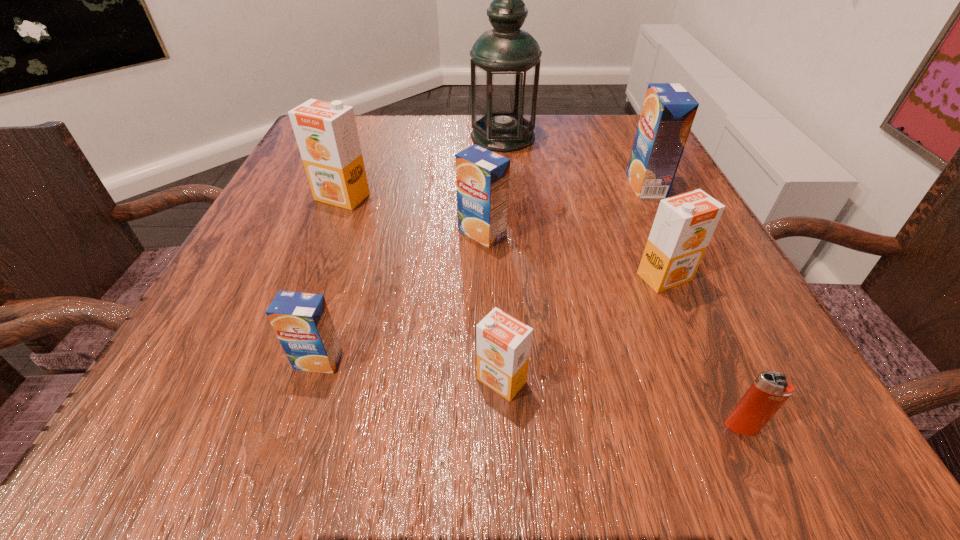
Where is `the farthest object`? The image size is (960, 540). the farthest object is located at coordinates (505, 61).

The height and width of the screenshot is (540, 960). I want to click on the tallest object, so click(x=505, y=61).

At what (x,y) coordinates should I click in order to perform the action: click on the farthest orange orange juice. Please return your answer as a coordinate pair (x, y). Looking at the image, I should click on (326, 133).

What are the coordinates of `the leftmost orange orange juice` in the screenshot? It's located at (326, 133).

The height and width of the screenshot is (540, 960). In order to click on the farthest blue orange_juice in this screenshot , I will do `click(668, 112)`.

I want to click on the biggest blue orange_juice, so click(x=668, y=112).

Find the location of `the second blue orange_juice from right to left`. the second blue orange_juice from right to left is located at coordinates (482, 176).

What are the coordinates of `the second farthest blue orange_juice` in the screenshot? It's located at (482, 176).

Where is `the second smallest orange orange juice`? This screenshot has width=960, height=540. the second smallest orange orange juice is located at coordinates (684, 224).

This screenshot has width=960, height=540. Find the location of `the fourth nearest object`. the fourth nearest object is located at coordinates (684, 224).